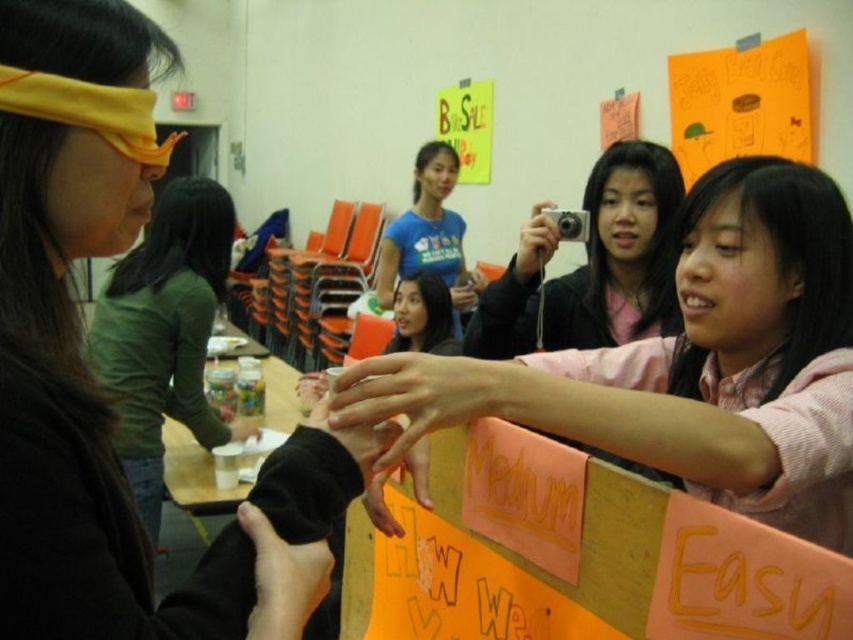
Who is more distant from viewer, (810, 401) or (802, 61)?

The point (802, 61) is behind.

Is point (807, 212) positioned behind point (740, 54)?

That is False.

Find the location of a particular element. The width and height of the screenshot is (853, 640). pink fabric shirt at center is located at coordinates (691, 362).

Is matte yellow blindfold at left further to camera compared to blue t-shirt at center?

No, matte yellow blindfold at left is in front of blue t-shirt at center.

Is matte yellow blindfold at left to the left of blue t-shirt at center from the viewer's perspective?

Yes, matte yellow blindfold at left is to the left of blue t-shirt at center.

Locate an element on the screen. matte yellow blindfold at left is located at coordinates (79, 337).

You are a GUI agent. You are given a task and a screenshot of the screen. Output one action in this format:
    pyautogui.click(x=<x>, y=<y>)
    Task: Click on the matte yellow blindfold at left
    This screenshot has width=853, height=640.
    Given the screenshot: What is the action you would take?
    pyautogui.click(x=79, y=337)

Can you confirm if green matte shirt at left is positioned to the right of pink matte camera at center?

No, green matte shirt at left is not to the right of pink matte camera at center.

Can you confirm if green matte shirt at left is positioned to the left of pink matte camera at center?

Yes, green matte shirt at left is to the left of pink matte camera at center.

Find the location of a particular element. green matte shirt at left is located at coordinates (164, 333).